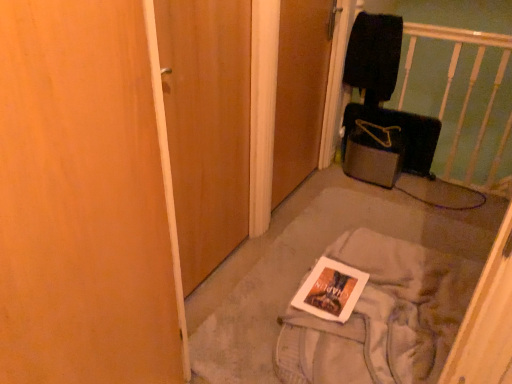
Question: From a real-world perspective, is white fabric book at center positioned above or below white glossy magazine at center?

Choices:
 (A) above
 (B) below

Answer: (B)

Question: Is white fabric book at center in front of or behind white glossy magazine at center in the image?

Choices:
 (A) behind
 (B) front

Answer: (B)

Question: Based on their relative distances, which object is farther from the white glossy magazine at center?

Choices:
 (A) black fabric infant bed at upper right
 (B) white fabric book at center
 (C) white paper at center
 (D) velvet black suitcase at right
 (E) wooden door at center, which is counted as the 1th door, starting from the right

Answer: (D)

Question: Based on their relative distances, which object is nearer to the black fabric infant bed at upper right?

Choices:
 (A) white glossy magazine at center
 (B) wooden door at center, which is counted as the 1th door, starting from the right
 (C) white fabric book at center
 (D) velvet black suitcase at right
 (E) wooden door at center, the 1th door when ordered from left to right

Answer: (D)